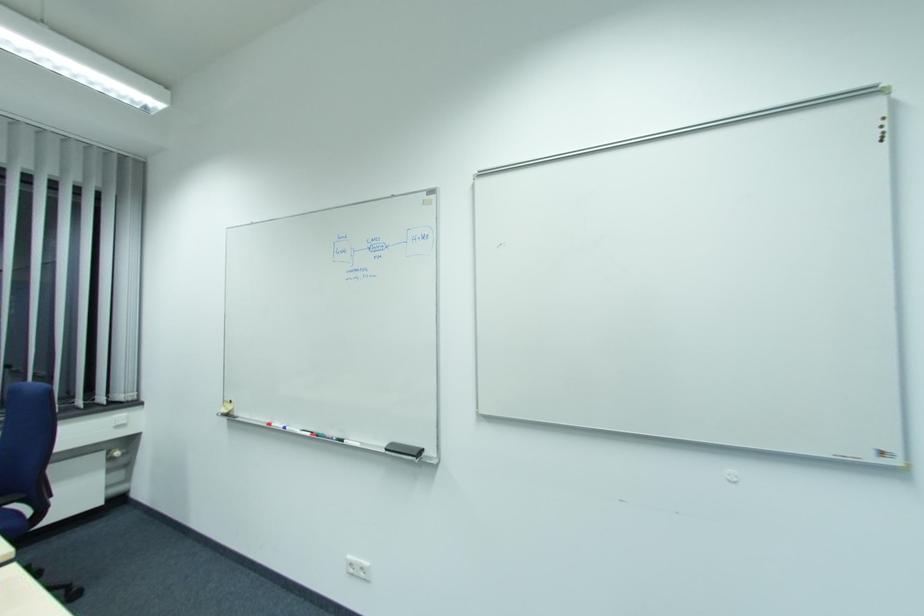
This screenshot has height=616, width=924. What are the coordinates of `blue whiteboard marker` in the screenshot? It's located at (348, 442).